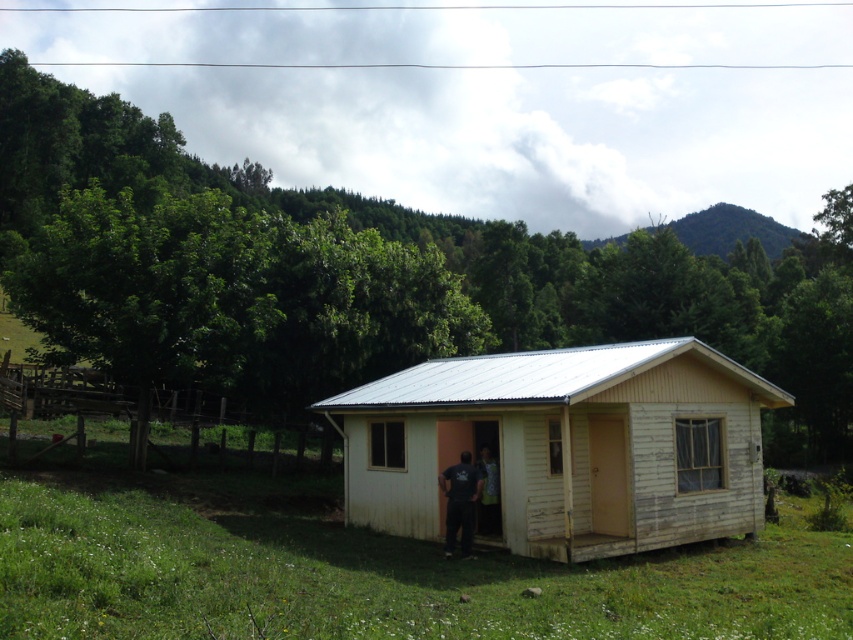
Based on the photo, you are standing outside the yellow wood cabin at center and want to place a 3m wide banner across its front. Considering the dark gray fabric pants at center are also present, can the banner fit without overlapping the pants?

The yellow wood cabin at center is wider than the dark gray fabric pants at center, so the 3m wide banner can fit across the cabin without overlapping the pants as the cabin itself is wider.

You are standing at the front door of the cabin and want to walk towards the point at coordinates point (618, 451) and point (445, 500). Which point will you reach first?

You will reach point (445, 500) first because it is in front of point (618, 451), which is located behind it.